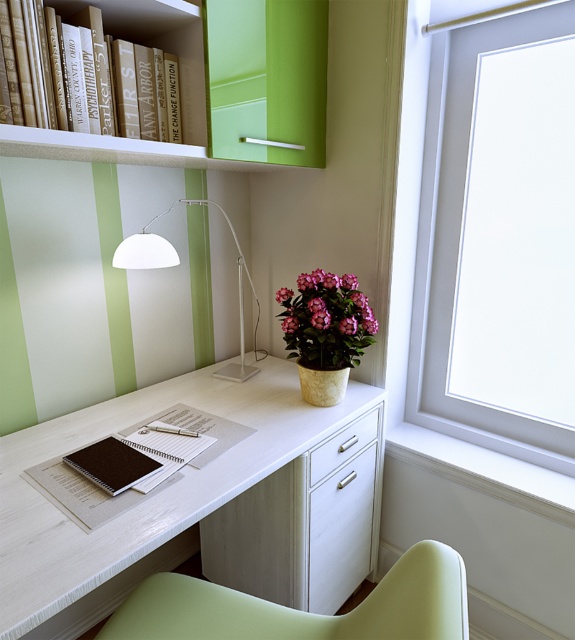
Question: Which object is positioned farthest from the hardcover book at upper left?

Choices:
 (A) white matte lamp at upper left
 (B) pink matte flower pot at upper right
 (C) white wood table at center

Answer: (C)

Question: Which of the following is the farthest from the observer?

Choices:
 (A) (69, 6)
 (B) (170, 406)

Answer: (B)

Question: Considering the real-world distances, which object is farthest from the green matte chair at lower center?

Choices:
 (A) green striped wall at upper left
 (B) matte black notebook at center
 (C) white wood drawer at lower center

Answer: (A)

Question: From the image, what is the correct spatial relationship of transparent glass window at upper right in relation to white glossy drawer at lower right?

Choices:
 (A) left
 (B) right

Answer: (B)

Question: Is pink matte flower pot at upper right closer to camera compared to green striped wall at upper left?

Choices:
 (A) no
 (B) yes

Answer: (B)

Question: Can you confirm if green matte chair at lower center is wider than white glossy drawer at lower right?

Choices:
 (A) no
 (B) yes

Answer: (B)